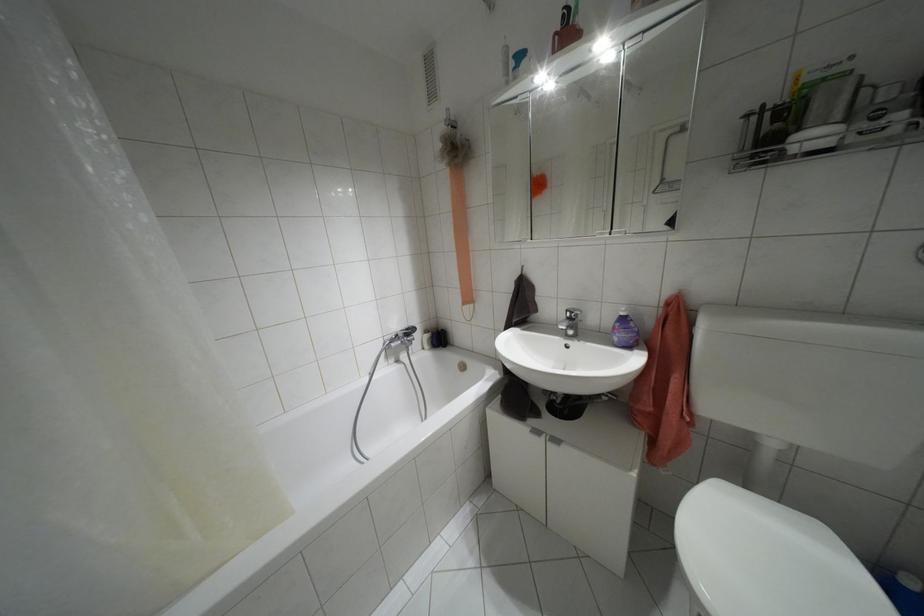
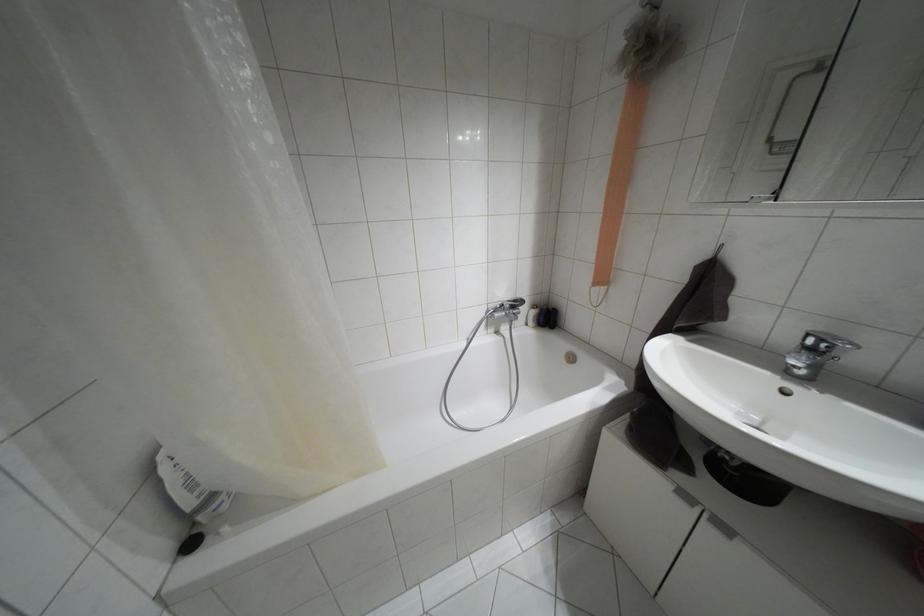
Where in the second image is the point corresponding to point (565, 310) from the first image?

(808, 334)